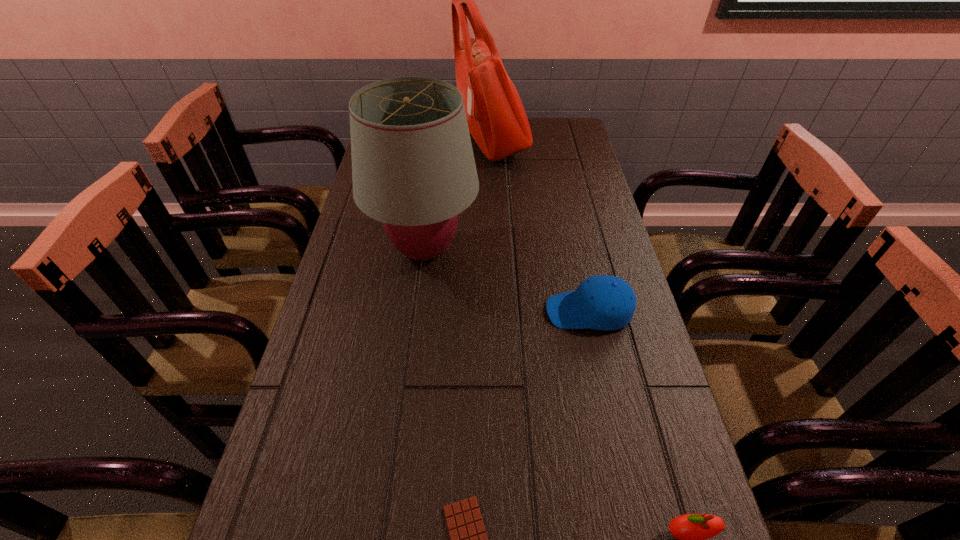
Where is `handbag`? handbag is located at coordinates (497, 121).

You are a GUI agent. You are given a task and a screenshot of the screen. Output one action in this format:
    pyautogui.click(x=<x>, y=<y>)
    Task: Click on the fourth nearest object
    Image resolution: width=960 pixels, height=540 pixels.
    Given the screenshot: What is the action you would take?
    pyautogui.click(x=413, y=169)

This screenshot has height=540, width=960. I want to click on the third nearest object, so click(603, 302).

Identify the location of vacant space located on the front-facing side of the handbag. This screenshot has width=960, height=540. (428, 143).

Identify the location of vacant space situated on the front-facing side of the handbag. (375, 143).

You are a GUI agent. You are given a task and a screenshot of the screen. Output one action in this format:
    pyautogui.click(x=<x>, y=<y>)
    Task: Click on the vacant space situated on the front-facing side of the handbag
    
    Given the screenshot: What is the action you would take?
    pyautogui.click(x=420, y=143)

Identify the location of free location located on the front of the second farthest object. This screenshot has width=960, height=540. (417, 306).

You are a GUI agent. You are given a task and a screenshot of the screen. Output one action in this format:
    pyautogui.click(x=<x>, y=<y>)
    Task: Click on the vacant space located 0.360m on the front-facing side of the third nearest object
    
    Given the screenshot: What is the action you would take?
    pyautogui.click(x=394, y=311)

Where is `vacant area located 0.380m on the front-facing side of the third nearest object`? vacant area located 0.380m on the front-facing side of the third nearest object is located at coordinates (385, 311).

Where is `vacant space situated 0.290m on the front-facing side of the third nearest object`? Image resolution: width=960 pixels, height=540 pixels. vacant space situated 0.290m on the front-facing side of the third nearest object is located at coordinates (423, 311).